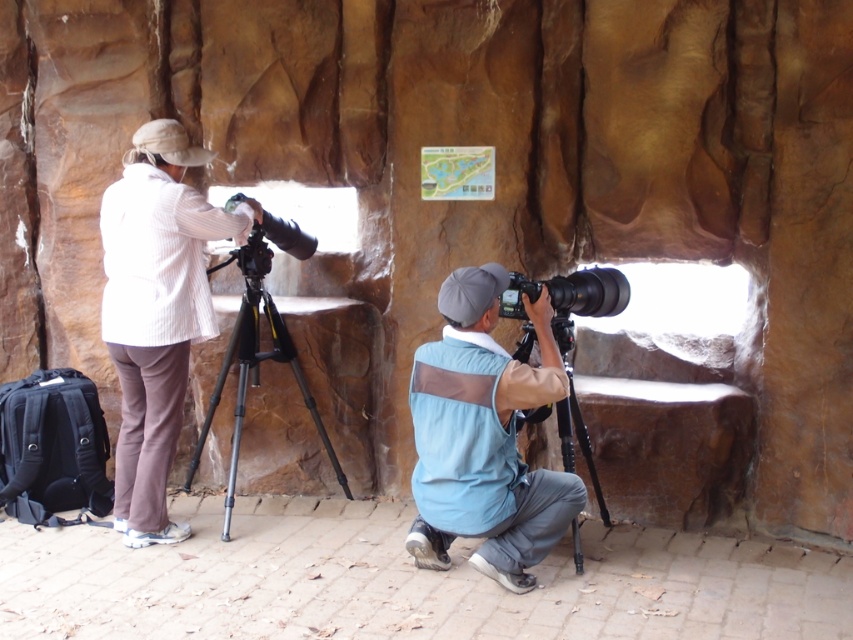
You are a photographer trying to set up your equipment. You have a white textured jacket at upper left and a black metal tripod at center. Which object is closer to the left edge of the image?

The white textured jacket at upper left is closer to the left edge of the image because it is positioned to the left of the black metal tripod at center.

You are a photographer trying to set up your equipment in the cave. You have a black metal tripod at center and a black plastic camera at center. According to the scene, which object is located to the left of the other?

The black metal tripod at center is positioned on the left side of black plastic camera at center.

You are a photographer trying to set up your equipment in the cave. You have a white textured jacket at upper left and a black metal tripod at lower center in your view. Which object occupies more horizontal space in the image?

The white textured jacket at upper left might be wider than the black metal tripod at lower center, so it likely occupies more horizontal space.